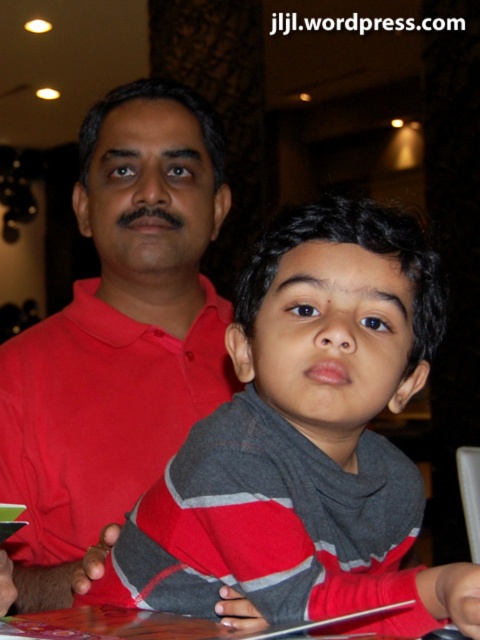
Does point (144, 163) come closer to viewer compared to point (147, 625)?

No, it is not.

Is point (142, 257) positioned after point (40, 627)?

Yes, it is behind point (40, 627).

The width and height of the screenshot is (480, 640). Identify the location of red matte shirt at center. (124, 321).

Who is taller, gray/red striped sweater at center or wooden table at lower center?

With more height is gray/red striped sweater at center.

Between gray/red striped sweater at center and wooden table at lower center, which one appears on the left side from the viewer's perspective?

Positioned to the left is wooden table at lower center.

Describe the element at coordinates (305, 440) in the screenshot. The width and height of the screenshot is (480, 640). I see `gray/red striped sweater at center` at that location.

This screenshot has height=640, width=480. I want to click on gray/red striped sweater at center, so click(305, 440).

Who is more forward, (443, 611) or (132, 476)?

Point (443, 611)

Does gray/red striped sweater at center have a greater height compared to red matte shirt at center?

In fact, gray/red striped sweater at center may be shorter than red matte shirt at center.

I want to click on gray/red striped sweater at center, so click(x=305, y=440).